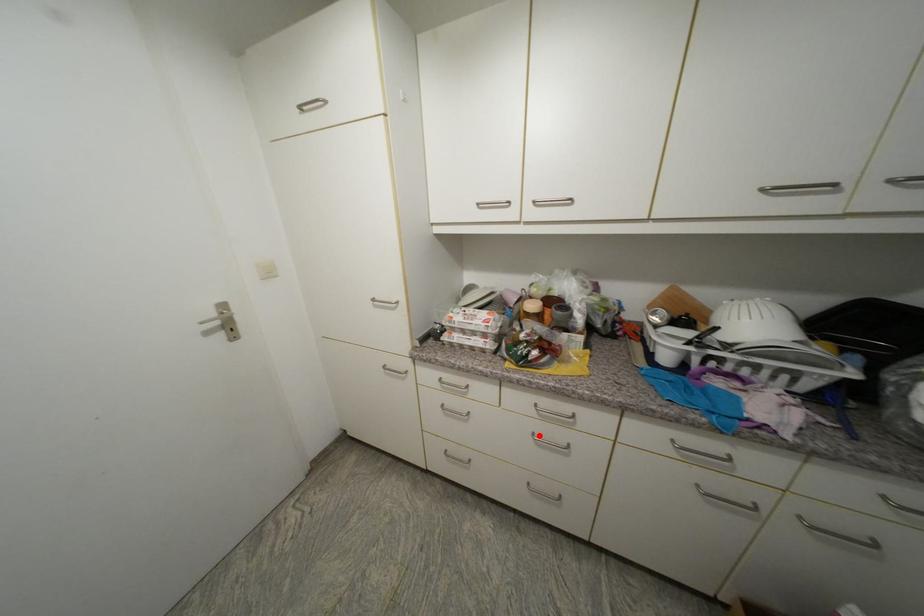
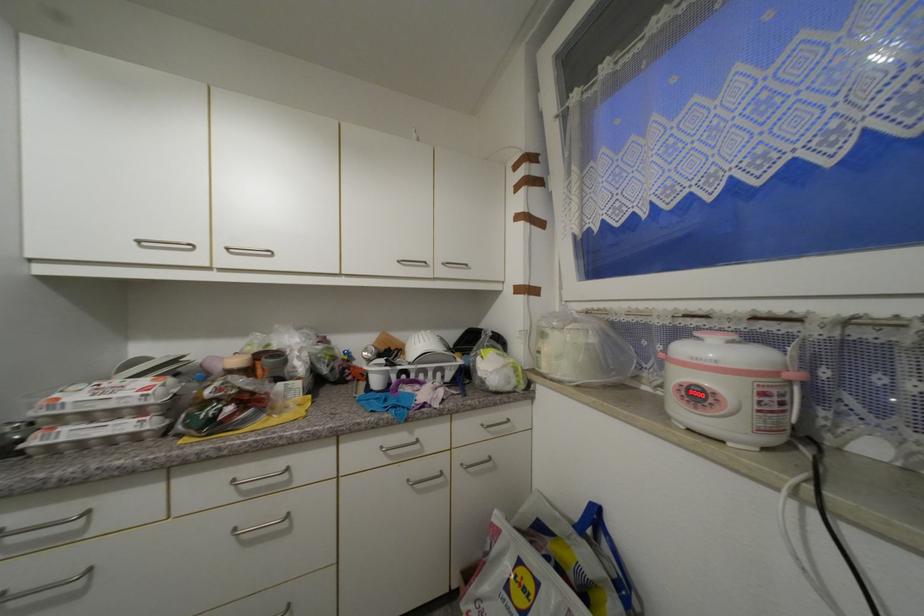
Question: I am providing you with two images of the same scene from different viewpoints. A red point is shown in image1. For the corresponding object point in image2, is it positioned nearer or farther from the camera?

Choices:
 (A) Nearer
 (B) Farther

Answer: (A)